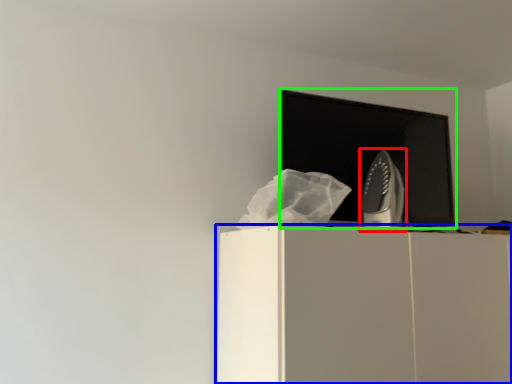
Question: Which object is positioned closest to home appliance (highlighted by a red box)? Select from furniture (highlighted by a blue box) and computer monitor (highlighted by a green box).

Choices:
 (A) furniture
 (B) computer monitor

Answer: (B)